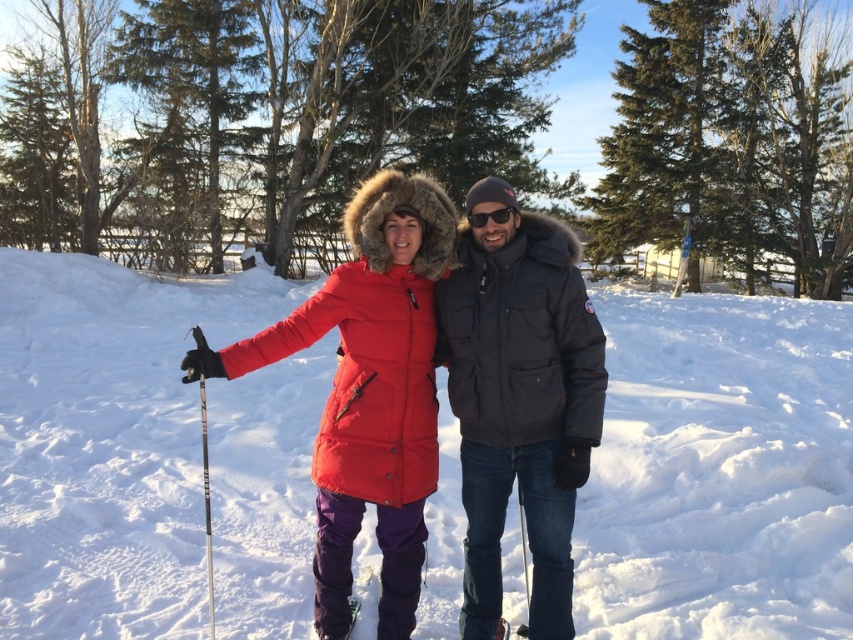
Question: Which is farther from the purple fabric ski at lower center?

Choices:
 (A) white plastic ski pole at left
 (B) black reflective sunglasses at center
 (C) white fluffy snow at center

Answer: (C)

Question: Observing the image, what is the correct spatial positioning of purple fabric ski at lower center in reference to black reflective sunglasses at center?

Choices:
 (A) right
 (B) left

Answer: (B)

Question: Which point is closer to the camera?

Choices:
 (A) white fluffy snow at center
 (B) white plastic ski pole at left

Answer: (B)

Question: Does matte red down jacket at center have a larger size compared to black reflective sunglasses at center?

Choices:
 (A) yes
 (B) no

Answer: (A)

Question: Is white fluffy snow at center behind matte red down jacket at center?

Choices:
 (A) no
 (B) yes

Answer: (B)

Question: Which of the following is the farthest from the observer?

Choices:
 (A) purple fabric ski at lower center
 (B) white plastic ski pole at left
 (C) white fluffy snow at center
 (D) black reflective sunglasses at center

Answer: (C)